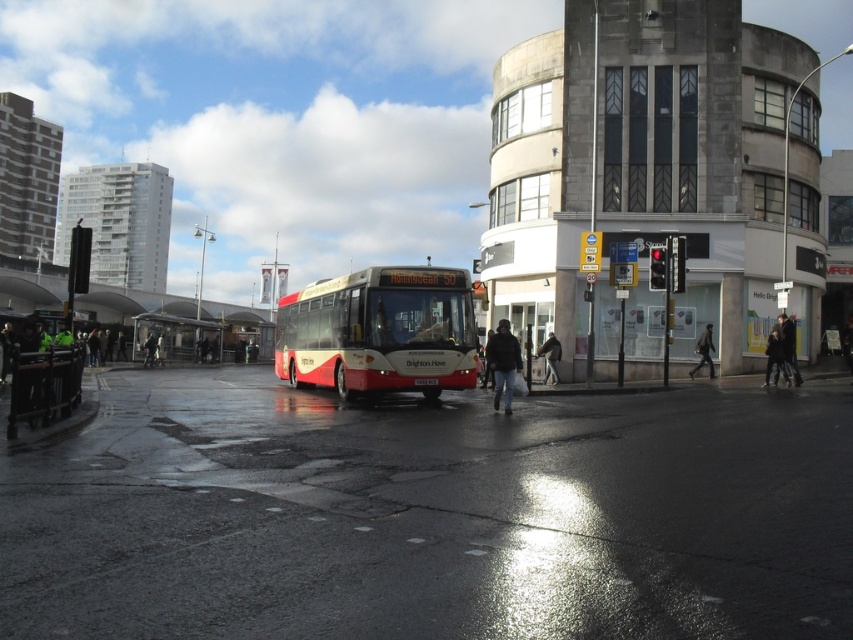
In the scene shown: Which is more to the left, dark gray jacket at lower right or dark gray fabric coat at center?

Positioned to the left is dark gray fabric coat at center.

Between point (775, 337) and point (553, 358), which one is positioned behind?

Point (553, 358)

Is point (782, 372) positioned after point (550, 348)?

No, it is in front of (550, 348).

Where is `dark gray jacket at lower right`? dark gray jacket at lower right is located at coordinates (775, 356).

Is point (784, 368) behind point (698, 362)?

No, it is not.

Can you confirm if dark gray jacket at lower right is thinner than dark gray jacket at center?

No, dark gray jacket at lower right is not thinner than dark gray jacket at center.

Who is more distant from viewer, (x=776, y=360) or (x=705, y=340)?

Point (x=705, y=340)

In order to click on dark gray jacket at lower right in this screenshot , I will do `click(775, 356)`.

Does dark brown leather jacket at lower right have a smaller size compared to dark gray fabric coat at center?

Yes, dark brown leather jacket at lower right is smaller than dark gray fabric coat at center.

Which is more to the right, dark brown leather jacket at lower right or dark gray fabric coat at center?

From the viewer's perspective, dark brown leather jacket at lower right appears more on the right side.

Locate an element on the screen. The width and height of the screenshot is (853, 640). dark brown leather jacket at lower right is located at coordinates (788, 346).

Identify the location of dark brown leather jacket at lower right. Image resolution: width=853 pixels, height=640 pixels. (788, 346).